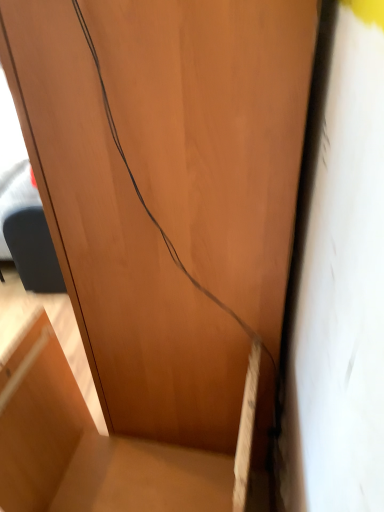
Question: Considering the relative sizes of brown matte wire at center and matte wood cabinet at center in the image provided, is brown matte wire at center smaller than matte wood cabinet at center?

Choices:
 (A) no
 (B) yes

Answer: (A)

Question: Can you confirm if brown matte wire at center is positioned to the left of matte wood cabinet at center?

Choices:
 (A) no
 (B) yes

Answer: (A)

Question: Is brown matte wire at center oriented away from matte wood cabinet at center?

Choices:
 (A) no
 (B) yes

Answer: (A)

Question: Is there a large distance between brown matte wire at center and matte wood cabinet at center?

Choices:
 (A) yes
 (B) no

Answer: (B)

Question: Is brown matte wire at center outside of matte wood cabinet at center?

Choices:
 (A) yes
 (B) no

Answer: (A)

Question: Can you confirm if brown matte wire at center is taller than matte wood cabinet at center?

Choices:
 (A) no
 (B) yes

Answer: (B)

Question: Is matte wood cabinet at center behind brown matte wire at center?

Choices:
 (A) no
 (B) yes

Answer: (B)

Question: Is brown matte wire at center a part of matte wood cabinet at center?

Choices:
 (A) no
 (B) yes

Answer: (A)

Question: Does matte wood cabinet at center come in front of brown matte wire at center?

Choices:
 (A) no
 (B) yes

Answer: (A)

Question: Can you confirm if matte wood cabinet at center is wider than brown matte wire at center?

Choices:
 (A) yes
 (B) no

Answer: (B)

Question: Is matte wood cabinet at center completely or partially outside of brown matte wire at center?

Choices:
 (A) yes
 (B) no

Answer: (A)

Question: Is matte wood cabinet at center shorter than brown matte wire at center?

Choices:
 (A) yes
 (B) no

Answer: (A)

Question: Considering the positions of point (220, 459) and point (92, 45), is point (220, 459) closer or farther from the camera than point (92, 45)?

Choices:
 (A) closer
 (B) farther

Answer: (B)